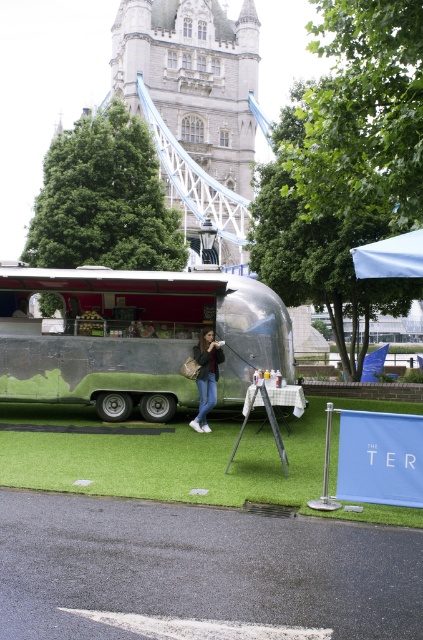
Question: Which object appears closest to the camera in this image?

Choices:
 (A) stone stonework tower bridge at upper center
 (B) white fabric canopy at upper right
 (C) silver metallic trailer at center

Answer: (B)

Question: Is silver metallic trailer at center further to camera compared to green artificial turf at center?

Choices:
 (A) yes
 (B) no

Answer: (A)

Question: Which point is farther to the camera?

Choices:
 (A) (373, 273)
 (B) (236, 420)
 (C) (164, 161)
 (D) (24, 324)

Answer: (C)

Question: Can you confirm if stone stonework tower bridge at upper center is bigger than green artificial turf at center?

Choices:
 (A) no
 (B) yes

Answer: (B)

Question: Does white fabric canopy at upper right appear over denim jeans at center?

Choices:
 (A) yes
 (B) no

Answer: (A)

Question: Which object appears farthest from the camera in this image?

Choices:
 (A) green artificial turf at center
 (B) stone stonework tower bridge at upper center
 (C) white fabric canopy at upper right

Answer: (B)